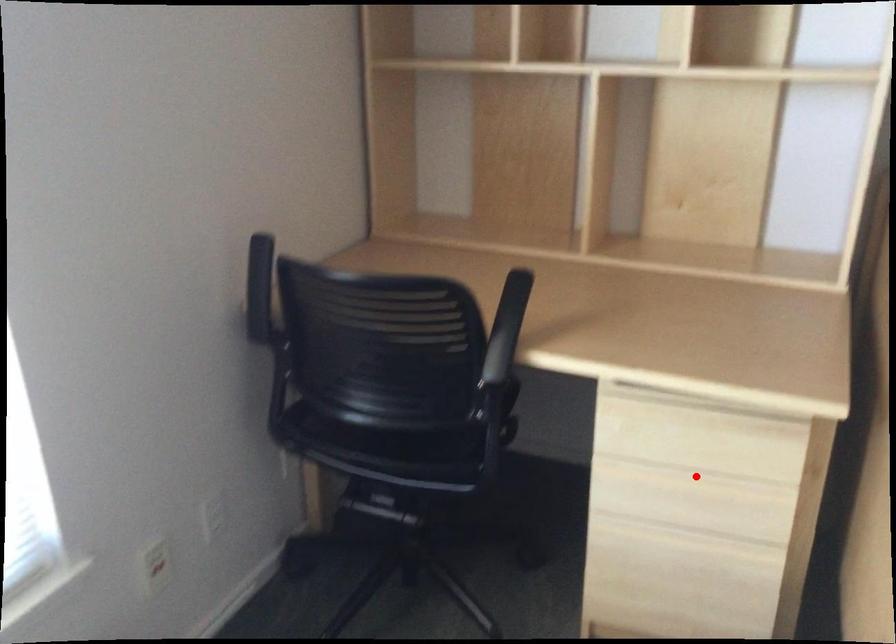
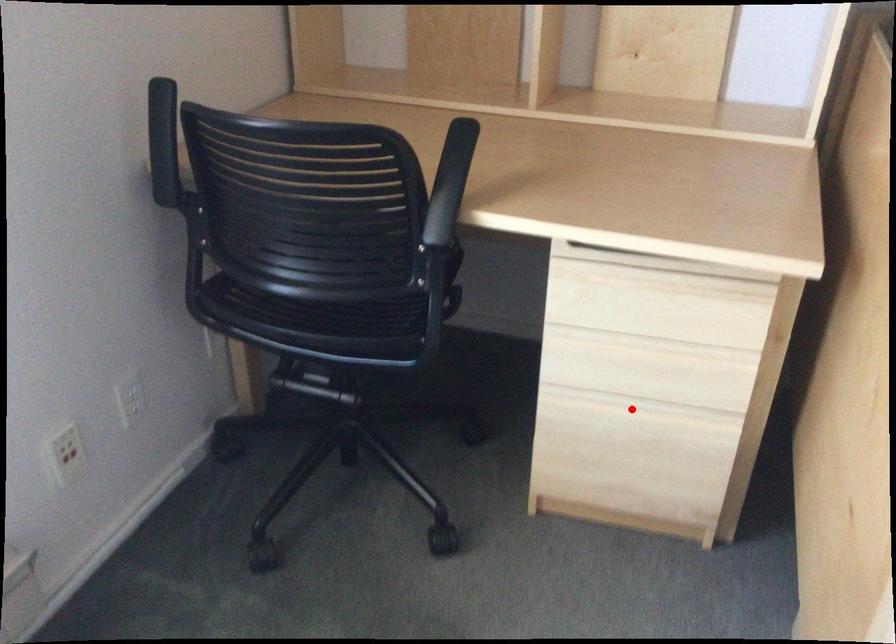
I am providing you with two images of the same scene from different viewpoints. A red point is marked on the first image and another point is marked on the second image. Are the points marked in image1 and image2 representing the same 3D position?

No